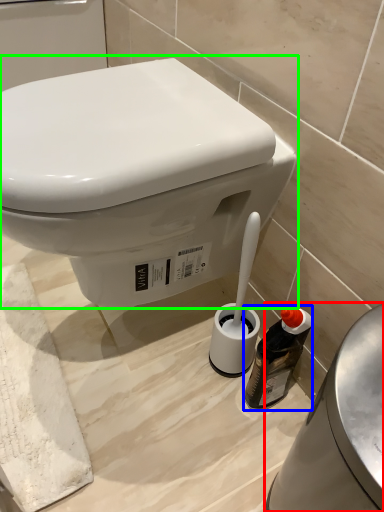
Question: Based on their relative distances, which object is nearer to porcelain (highlighted by a red box)? Choose from bottle (highlighted by a blue box) and toilet (highlighted by a green box).

Choices:
 (A) bottle
 (B) toilet

Answer: (A)